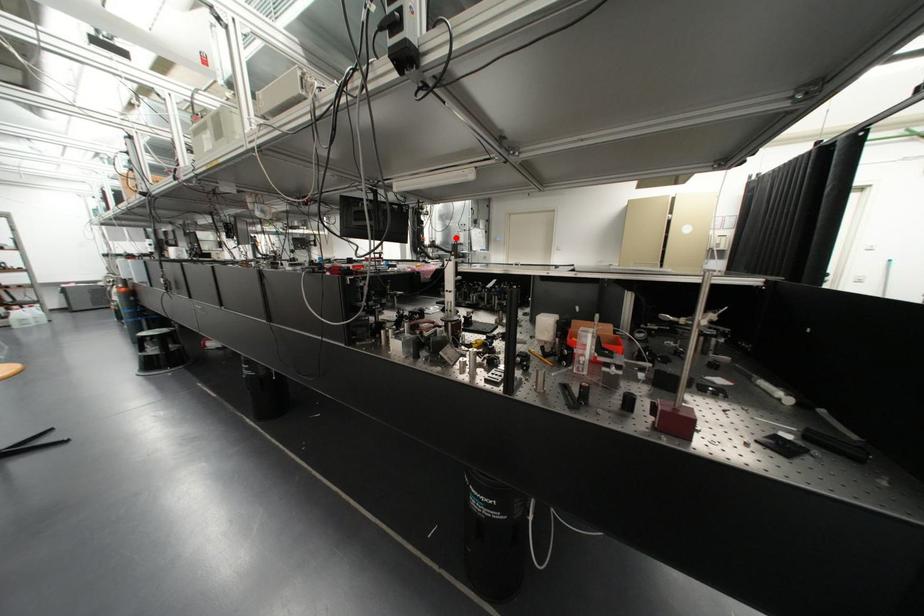
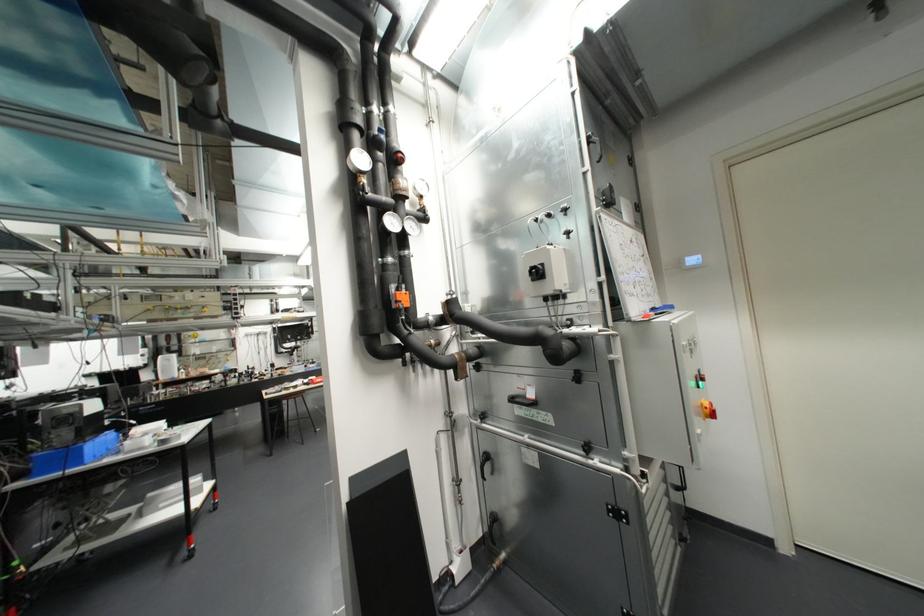
Question: A red point is marked in image1. In image2, is the corresponding 3D point closer to the camera or farther? Reply with the corresponding letter.

Choices:
 (A) The corresponding 3D point is closer.
 (B) The corresponding 3D point is farther.

Answer: (B)